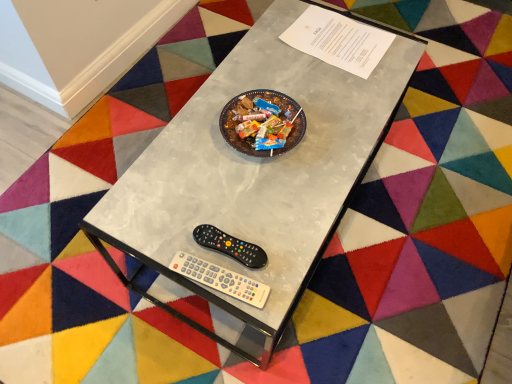
In order to click on free space to the left of white plastic wii controller at lower center in this screenshot , I will do `click(144, 235)`.